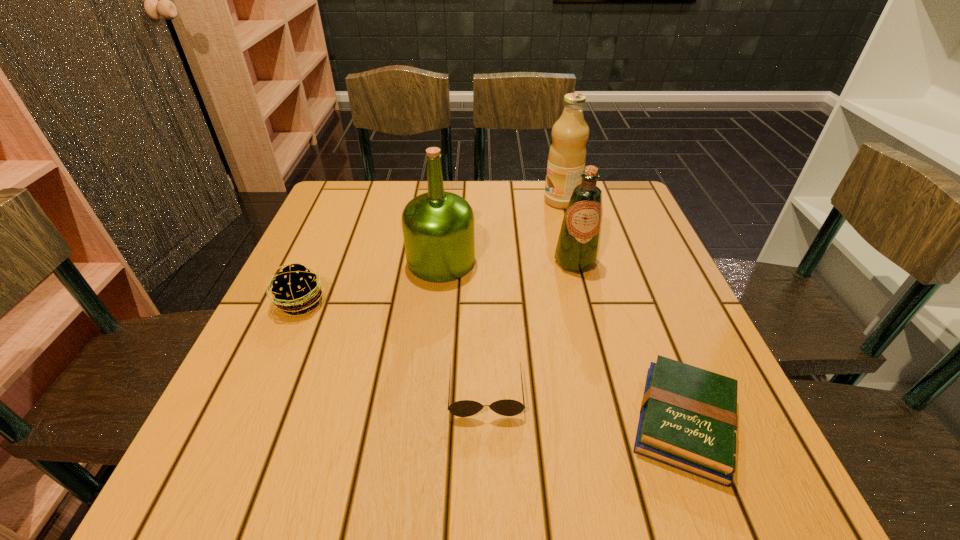
At what (x,y) coordinates should I click in order to perform the action: click on vacant space located on the left of the leftmost olive oil. Please return your answer as a coordinate pair (x, y). Image resolution: width=960 pixels, height=540 pixels. Looking at the image, I should click on (321, 261).

At what (x,y) coordinates should I click in order to perform the action: click on free region located on the front-facing side of the third tallest object. Please return your answer as a coordinate pair (x, y). Looking at the image, I should click on (608, 386).

The height and width of the screenshot is (540, 960). I want to click on free space located on the right of the third nearest object, so click(490, 302).

Where is `free location located on the front-facing side of the sunglasses`? Image resolution: width=960 pixels, height=540 pixels. free location located on the front-facing side of the sunglasses is located at coordinates (487, 473).

Where is `vacant position located 0.310m on the back of the book`? Image resolution: width=960 pixels, height=540 pixels. vacant position located 0.310m on the back of the book is located at coordinates (622, 260).

Find the location of a particular element. The width and height of the screenshot is (960, 540). object located at the far edge is located at coordinates pos(567,155).

Where is `object located at the near edge`? object located at the near edge is located at coordinates (688, 417).

Locate an element on the screen. This screenshot has height=540, width=960. object positioned at the left edge is located at coordinates (295, 288).

In order to click on book at the right edge in this screenshot , I will do `click(688, 417)`.

Locate an element on the screen. This screenshot has width=960, height=540. object situated at the far right corner is located at coordinates (567, 155).